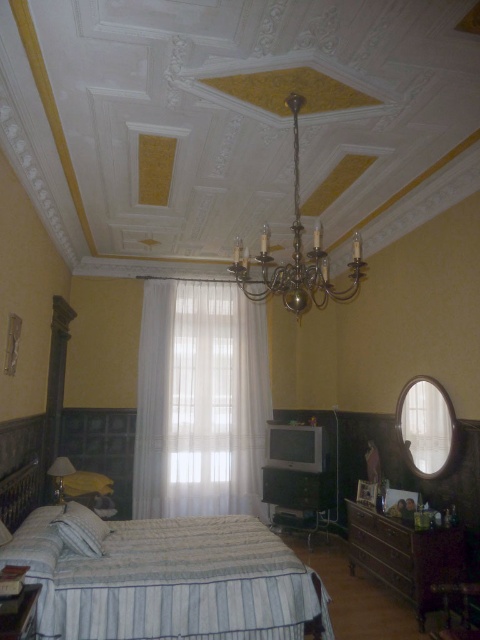
Can you confirm if white striped bed at center is positioned above wooden dresser at lower right?

Yes, white striped bed at center is above wooden dresser at lower right.

Is white striped bed at center in front of wooden dresser at lower right?

Yes, it is in front of wooden dresser at lower right.

In order to click on white striped bed at center in this screenshot , I will do `click(169, 580)`.

Is point (156, 346) positioned in front of point (230, 268)?

No, it is behind (230, 268).

Where is `sheer white curtain at center`? sheer white curtain at center is located at coordinates (200, 401).

Is white striped bed at center positioned before sheer white curtain at center?

Yes, white striped bed at center is in front of sheer white curtain at center.

Can you confirm if white striped bed at center is taller than sheer white curtain at center?

No, white striped bed at center is not taller than sheer white curtain at center.

Does point (231, 589) come in front of point (248, 308)?

Yes, it is in front of point (248, 308).

Image resolution: width=480 pixels, height=640 pixels. I want to click on white striped bed at center, so click(169, 580).